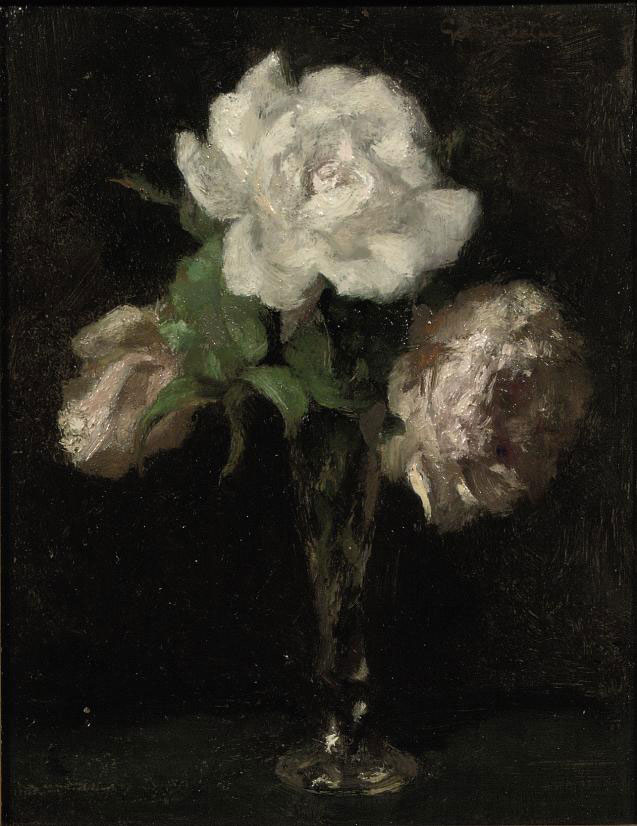
Where is `vase`? The image size is (637, 826). vase is located at coordinates (338, 586).